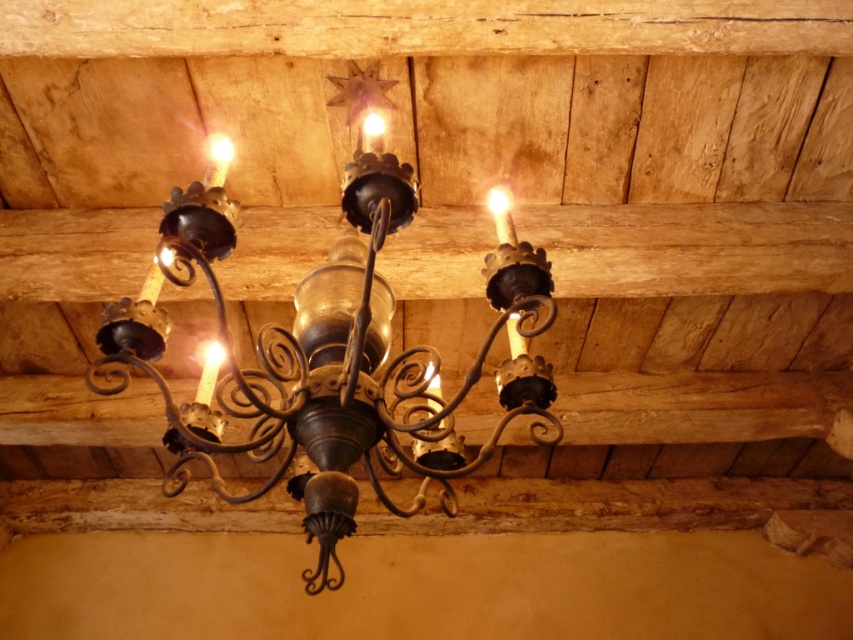
Question: Which point is closer to the camera?

Choices:
 (A) matte gold light at upper center
 (B) matte glass light at upper center
 (C) matte gold candle at center
 (D) matte glass light at center

Answer: (D)

Question: Where is antique brass chandelier at center located in relation to matte gold candle at center in the image?

Choices:
 (A) left
 (B) right

Answer: (B)

Question: Estimate the real-world distances between objects in this image. Which object is closer to the matte glass light at upper center?

Choices:
 (A) matte gold candle at center
 (B) matte glass light at center
 (C) antique brass chandelier at center

Answer: (B)

Question: Where is matte gold light at upper center located in relation to matte glass light at center in the image?

Choices:
 (A) below
 (B) above

Answer: (A)

Question: Does matte gold light at upper center appear under matte glass light at center?

Choices:
 (A) no
 (B) yes

Answer: (B)

Question: Considering the real-world distances, which object is closest to the matte gold light at upper center?

Choices:
 (A) matte glass light at center
 (B) matte glass light at upper center
 (C) matte gold candle at center
 (D) antique brass chandelier at center

Answer: (A)